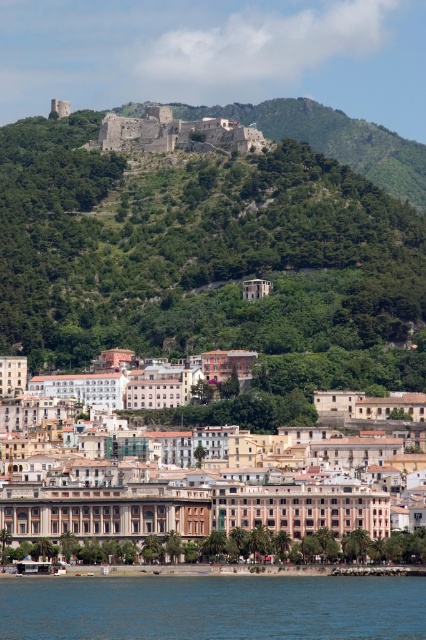
You are standing in the coastal town and want to take a photo of both the green leafy hillside at upper center and the blue liquid water at lower center. Which object should you focus on first to ensure both are in clear view?

You should focus on the green leafy hillside at upper center first since it is closer to you than the blue liquid water at lower center. By focusing on the closer object, the background object will also be in focus due to depth of field.

You are a tourist standing in the coastal town looking at the scene. Which object occupies more area in the image, the green leafy hillside at upper center or the blue liquid water at lower center?

The green leafy hillside at upper center is bigger than the blue liquid water at lower center, so the green leafy hillside at upper center occupies more area in the image.